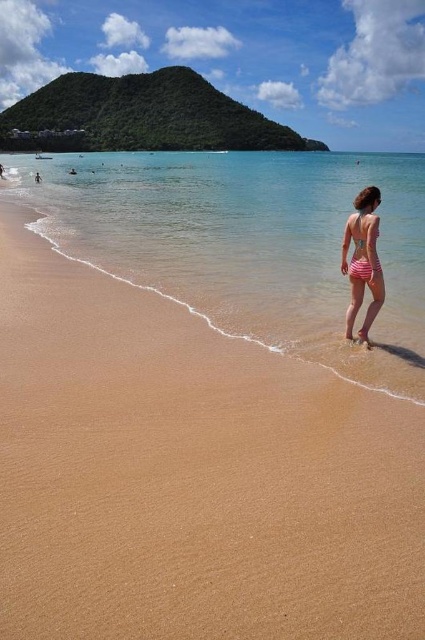
You are standing on the beach and see two points marked on the image. The first point is at coordinates point (11, 634) and the second is at point (365, 225). Which point is closer to you?

Point (11, 634) is closer to the viewer than point (365, 225).

You are standing on the beach and want to reach the clear blue water at center. According to the coordinates given, in which direction should you walk from your current position at the origin point? Please specify the direction as either north, south, east, or west.

The clear blue water at center is located at coordinates point (x=248, y=243). Since the y coordinate is higher than 0.5, it is north of the origin. The x coordinate is 0.381, which is to the west of the origin. Therefore, you should walk northwest to reach the clear blue water at center.

In the scene shown: You are standing at the point labeled point [189,474] in the image. Based on the scene description, what type of terrain would you expect to find under your feet?

The point [189,474] corresponds to sandy tan beach at center, so you would expect to find sand under your feet.